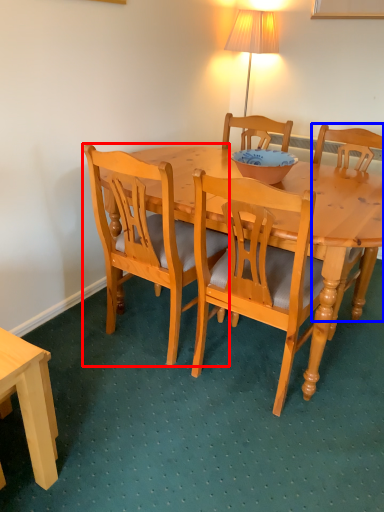
Question: Among these objects, which one is farthest to the camera, chair (highlighted by a red box) or chair (highlighted by a blue box)?

Choices:
 (A) chair
 (B) chair

Answer: (B)